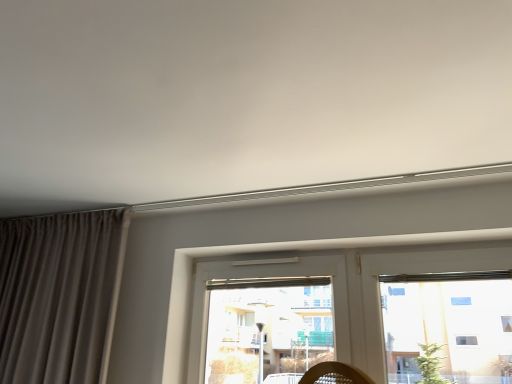
Describe the element at coordinates (355, 313) in the screenshot. I see `transparent glass window at center` at that location.

Measure the distance between point (475,379) and camera.

The distance of point (475,379) from camera is 7.66 feet.

Where is `transparent glass window at center`? This screenshot has height=384, width=512. transparent glass window at center is located at coordinates (355, 313).

Measure the distance between transparent glass window at center and camera.

transparent glass window at center and camera are 1.91 meters apart.

The height and width of the screenshot is (384, 512). Identify the location of matte gray curtain at left. (58, 294).

In order to face matte gray curtain at left, should I rotate leftwards or rightwards?

Turn left by 27.321 degrees to look at matte gray curtain at left.

Measure the distance between point [9,287] and camera.

The distance of point [9,287] from camera is 7.50 feet.

Describe the element at coordinates (58, 294) in the screenshot. I see `matte gray curtain at left` at that location.

Where is `transparent glass window at center`? The image size is (512, 384). transparent glass window at center is located at coordinates (355, 313).

Which is more to the right, matte gray curtain at left or transparent glass window at center?

From the viewer's perspective, transparent glass window at center appears more on the right side.

Is matte gray curtain at left positioned in front of transparent glass window at center?

No, it is not.

Is point (86, 263) positioned after point (413, 269)?

Yes, it is behind point (413, 269).

From the image's perspective, which one is positioned higher, matte gray curtain at left or transparent glass window at center?

matte gray curtain at left, from the image's perspective.

From a real-world perspective, is matte gray curtain at left above or below transparent glass window at center?

matte gray curtain at left is situated higher than transparent glass window at center in the real world.

Which of these two, matte gray curtain at left or transparent glass window at center, is thinner?

Thinner between the two is transparent glass window at center.

Does matte gray curtain at left have a greater height compared to transparent glass window at center?

Yes, matte gray curtain at left is taller than transparent glass window at center.

Is matte gray curtain at left smaller than transparent glass window at center?

Incorrect, matte gray curtain at left is not smaller in size than transparent glass window at center.

Does matte gray curtain at left contain transparent glass window at center?

No, transparent glass window at center is located outside of matte gray curtain at left.

Is there a large distance between matte gray curtain at left and transparent glass window at center?

They are positioned close to each other.

Could you tell me if matte gray curtain at left is turned towards transparent glass window at center?

No, matte gray curtain at left is not aimed at transparent glass window at center.

Measure the distance between matte gray curtain at left and transparent glass window at center.

31.38 inches.

The width and height of the screenshot is (512, 384). Identify the location of curtain located above the transparent glass window at center (from a real-world perspective). (58, 294).

Considering the positions of objects transparent glass window at center and matte gray curtain at left in the image provided, who is more to the left, transparent glass window at center or matte gray curtain at left?

matte gray curtain at left is more to the left.

Is the depth of transparent glass window at center greater than that of matte gray curtain at left?

No, transparent glass window at center is closer to the camera.

Considering the points (322, 292) and (1, 266), which point is behind, point (322, 292) or point (1, 266)?

Positioned behind is point (1, 266).

From the image's perspective, between transparent glass window at center and matte gray curtain at left, which one is located above?

matte gray curtain at left.

From a real-world perspective, which object stands above the other?

matte gray curtain at left, from a real-world perspective.

Is transparent glass window at center thinner than matte gray curtain at left?

Indeed, transparent glass window at center has a lesser width compared to matte gray curtain at left.

Looking at this image, in terms of height, does transparent glass window at center look taller or shorter compared to matte gray curtain at left?

Considering their sizes, transparent glass window at center has less height than matte gray curtain at left.

Who is bigger, transparent glass window at center or matte gray curtain at left?

Bigger between the two is matte gray curtain at left.

Is matte gray curtain at left located within transparent glass window at center?

No, matte gray curtain at left is not surrounded by transparent glass window at center.

Is transparent glass window at center beside matte gray curtain at left?

No, transparent glass window at center is not in contact with matte gray curtain at left.

Is transparent glass window at center oriented towards matte gray curtain at left?

No, transparent glass window at center does not turn towards matte gray curtain at left.

Consider the image. How distant is transparent glass window at center from matte gray curtain at left?

transparent glass window at center and matte gray curtain at left are 31.38 inches apart.

Where is `window located in front of the matte gray curtain at left`? The image size is (512, 384). window located in front of the matte gray curtain at left is located at coordinates tap(355, 313).

I want to click on window below the matte gray curtain at left (from the image's perspective), so click(355, 313).

The height and width of the screenshot is (384, 512). What are the coordinates of `window on the right side of matte gray curtain at left` in the screenshot? It's located at (355, 313).